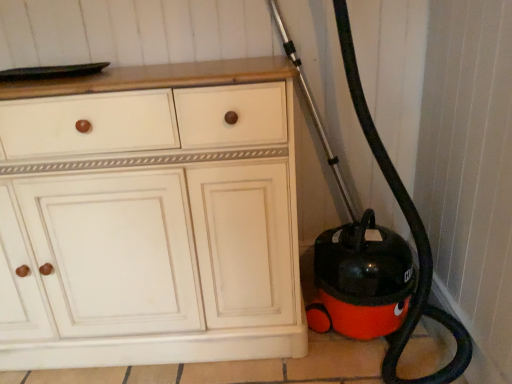
What is the approximate height of black rubber garden hose at right?

black rubber garden hose at right is 1.07 meters in height.

What do you see at coordinates (411, 232) in the screenshot?
I see `black rubber garden hose at right` at bounding box center [411, 232].

This screenshot has height=384, width=512. What are the coordinates of `black rubber garden hose at right` in the screenshot? It's located at (411, 232).

You are a GUI agent. You are given a task and a screenshot of the screen. Output one action in this format:
    pyautogui.click(x=<x>, y=<y>)
    Task: Click on the white wood cabinet at center
    This screenshot has height=384, width=512.
    Given the screenshot: What is the action you would take?
    pyautogui.click(x=150, y=217)

What do you see at coordinates (150, 217) in the screenshot? The image size is (512, 384). I see `white wood cabinet at center` at bounding box center [150, 217].

The width and height of the screenshot is (512, 384). In order to click on black rubber garden hose at right in this screenshot , I will do `click(411, 232)`.

Does black rubber garden hose at right appear on the right side of white wood cabinet at center?

Yes.

Is black rubber garden hose at right further to camera compared to white wood cabinet at center?

No, it is not.

Does point (342, 44) come in front of point (33, 272)?

No.

From the image's perspective, is black rubber garden hose at right located above or below white wood cabinet at center?

From the image's perspective, black rubber garden hose at right appears above white wood cabinet at center.

Consider the image. From a real-world perspective, which object stands above the other?

black rubber garden hose at right is physically above.

Considering the sizes of objects black rubber garden hose at right and white wood cabinet at center in the image provided, who is wider, black rubber garden hose at right or white wood cabinet at center?

black rubber garden hose at right is wider.

In terms of height, does black rubber garden hose at right look taller or shorter compared to white wood cabinet at center?

black rubber garden hose at right is taller than white wood cabinet at center.

Can you confirm if black rubber garden hose at right is bigger than white wood cabinet at center?

Actually, black rubber garden hose at right might be smaller than white wood cabinet at center.

Is black rubber garden hose at right inside or outside of white wood cabinet at center?

black rubber garden hose at right is outside white wood cabinet at center.

Is black rubber garden hose at right not close to white wood cabinet at center?

Actually, black rubber garden hose at right and white wood cabinet at center are a little close together.

Is black rubber garden hose at right turned away from white wood cabinet at center?

black rubber garden hose at right is not turned away from white wood cabinet at center.

The height and width of the screenshot is (384, 512). What are the coordinates of `garden hose in front of the white wood cabinet at center` in the screenshot? It's located at (411, 232).

Considering the positions of objects white wood cabinet at center and black rubber garden hose at right in the image provided, who is more to the left, white wood cabinet at center or black rubber garden hose at right?

Positioned to the left is white wood cabinet at center.

Between white wood cabinet at center and black rubber garden hose at right, which one is positioned in front?

black rubber garden hose at right is closer to the camera.

Is point (287, 286) less distant than point (406, 210)?

No, it is not.

From the image's perspective, who appears lower, white wood cabinet at center or black rubber garden hose at right?

white wood cabinet at center is shown below in the image.

From a real-world perspective, which object stands above the other?

black rubber garden hose at right.

Is white wood cabinet at center wider than black rubber garden hose at right?

Incorrect, the width of white wood cabinet at center does not surpass that of black rubber garden hose at right.

Considering the sizes of white wood cabinet at center and black rubber garden hose at right in the image, is white wood cabinet at center taller or shorter than black rubber garden hose at right?

white wood cabinet at center is shorter than black rubber garden hose at right.

Consider the image. Can you confirm if white wood cabinet at center is smaller than black rubber garden hose at right?

No, white wood cabinet at center is not smaller than black rubber garden hose at right.

Could black rubber garden hose at right be considered to be inside white wood cabinet at center?

No.

Is white wood cabinet at center positioned far away from black rubber garden hose at right?

That's not correct — white wood cabinet at center is a little close to black rubber garden hose at right.

Is white wood cabinet at center aimed at black rubber garden hose at right?

No, white wood cabinet at center is not oriented towards black rubber garden hose at right.

What's the angular difference between white wood cabinet at center and black rubber garden hose at right's facing directions?

3.17 degrees separate the facing orientations of white wood cabinet at center and black rubber garden hose at right.

Image resolution: width=512 pixels, height=384 pixels. In order to click on garden hose located above the white wood cabinet at center (from a real-world perspective) in this screenshot , I will do `click(411, 232)`.

Identify the location of garden hose in front of the white wood cabinet at center. The width and height of the screenshot is (512, 384). [x=411, y=232].

Find the location of a particular element. the chest of drawers directly beneath the black rubber garden hose at right (from a real-world perspective) is located at coordinates (150, 217).